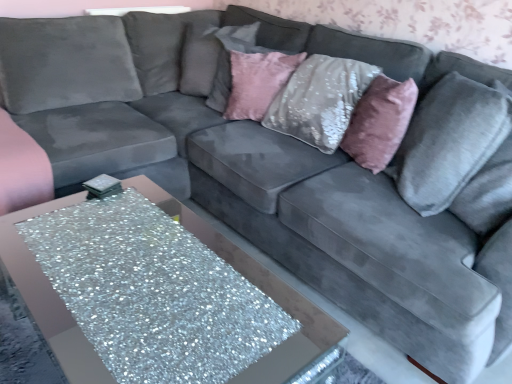
Question: Can you confirm if pink velvet pillow at upper center, which is the second pillow from right to left, is taller than velvet gray pillow at upper center, the 3th pillow when ordered from front to back?

Choices:
 (A) no
 (B) yes

Answer: (A)

Question: From a real-world perspective, does pink velvet pillow at upper center, which ranks as the second pillow in front-to-back order, stand above velvet gray pillow at upper center, marked as the 3th pillow in a right-to-left arrangement?

Choices:
 (A) yes
 (B) no

Answer: (B)

Question: Considering the relative positions of pink velvet pillow at upper center, which is the second pillow from right to left, and velvet gray pillow at upper center, the 1th pillow viewed from the left, in the image provided, is pink velvet pillow at upper center, which is the second pillow from right to left, to the left of velvet gray pillow at upper center, the 1th pillow viewed from the left, from the viewer's perspective?

Choices:
 (A) no
 (B) yes

Answer: (A)

Question: Is pink velvet pillow at upper center, the 2th pillow positioned from the left, outside velvet gray pillow at upper center, the 1th pillow viewed from the left?

Choices:
 (A) no
 (B) yes

Answer: (B)

Question: Is pink velvet pillow at upper center, which is counted as the 2th pillow, starting from the back, further to the viewer compared to velvet gray pillow at upper center, the 3th pillow when ordered from front to back?

Choices:
 (A) yes
 (B) no

Answer: (B)

Question: Considering the positions of pink velvet pillow at upper center, which ranks as the second pillow in front-to-back order, and velvet gray pillow at upper center, the 1th pillow viewed from the left, in the image, is pink velvet pillow at upper center, which ranks as the second pillow in front-to-back order, wider or thinner than velvet gray pillow at upper center, the 1th pillow viewed from the left,?

Choices:
 (A) wide
 (B) thin

Answer: (B)

Question: From the image's perspective, is pink velvet pillow at upper center, which is the second pillow from right to left, positioned above or below velvet gray pillow at upper center, placed as the 1th pillow when sorted from back to front?

Choices:
 (A) below
 (B) above

Answer: (A)

Question: In terms of height, does pink velvet pillow at upper center, which is the second pillow from right to left, look taller or shorter compared to velvet gray pillow at upper center, marked as the 3th pillow in a right-to-left arrangement?

Choices:
 (A) short
 (B) tall

Answer: (A)

Question: Is point (254, 82) positioned closer to the camera than point (247, 36)?

Choices:
 (A) farther
 (B) closer

Answer: (B)

Question: Is glittery silver table at lower left to the left or to the right of pink velvet pillow at upper center, which is the second pillow from right to left, in the image?

Choices:
 (A) right
 (B) left

Answer: (B)

Question: Is point (242, 251) closer or farther from the camera than point (263, 59)?

Choices:
 (A) closer
 (B) farther

Answer: (B)

Question: In terms of width, does glittery silver table at lower left look wider or thinner when compared to pink velvet pillow at upper center, which ranks as the second pillow in front-to-back order?

Choices:
 (A) thin
 (B) wide

Answer: (B)

Question: Do you think glittery silver table at lower left is within pink velvet pillow at upper center, the 2th pillow positioned from the left, or outside of it?

Choices:
 (A) inside
 (B) outside

Answer: (B)

Question: From the image's perspective, is velvet gray pillow at right, which is counted as the 3th pillow, starting from the back, positioned above or below pink plush throw pillow at upper right?

Choices:
 (A) above
 (B) below

Answer: (B)

Question: Is velvet gray pillow at right, marked as the third pillow in a left-to-right arrangement, to the left or to the right of pink plush throw pillow at upper right in the image?

Choices:
 (A) right
 (B) left

Answer: (A)